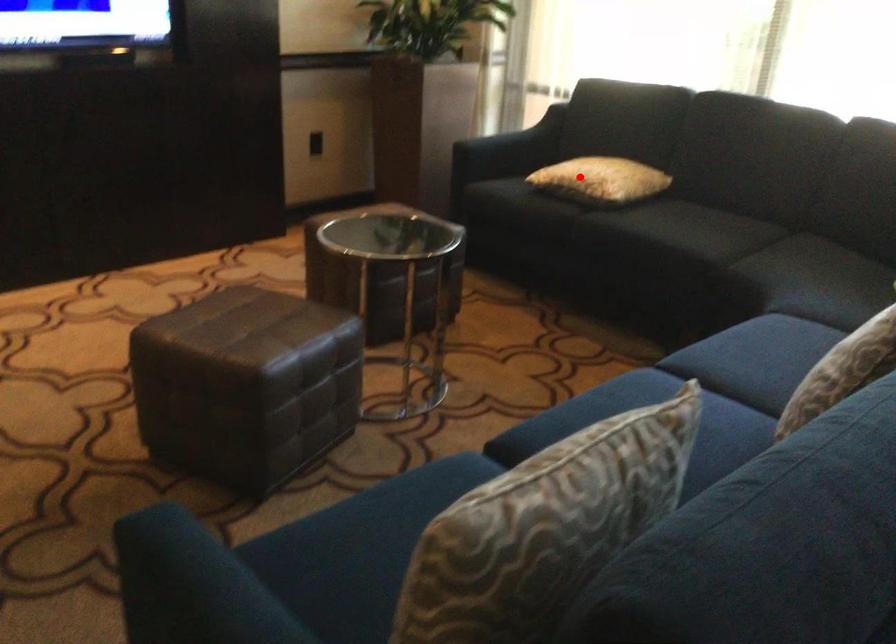
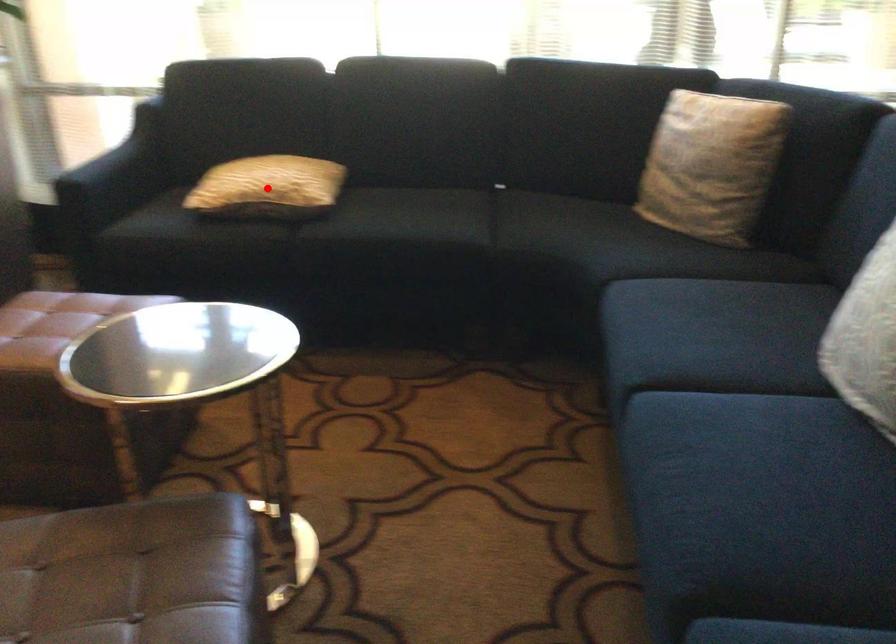
I am providing you with two images of the same scene from different viewpoints. A red point is marked on the first image and another point is marked on the second image. Is the marked point in image1 the same physical position as the marked point in image2?

Yes